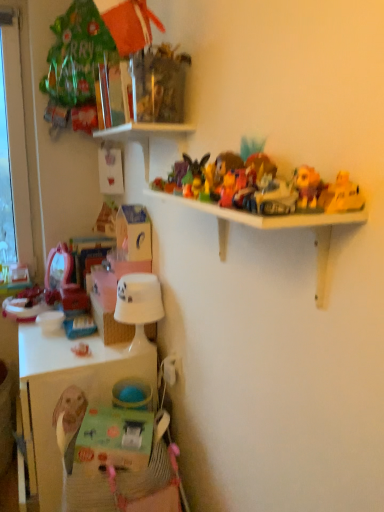
The height and width of the screenshot is (512, 384). In order to click on woven straw basket at lower center in this screenshot , I will do `click(110, 324)`.

Locate an element on the screen. The width and height of the screenshot is (384, 512). matte pink toy at lower left, the second toy when ordered from top to bottom is located at coordinates (81, 350).

Identify the location of matte cardboard box at lower left. This screenshot has width=384, height=512. (134, 232).

This screenshot has height=512, width=384. I want to click on white glossy lampshade at lower center, so click(x=139, y=306).

The image size is (384, 512). I want to click on woven straw basket at lower center, so click(110, 324).

Is matte cardboard box at lower left positioned with its back to plush yellow bear at upper right, marked as the 1th toy in a front-to-back arrangement?

No.

Is the depth of matte cardboard box at lower left less than that of plush yellow bear at upper right, positioned as the first toy in right-to-left order?

No, it is behind plush yellow bear at upper right, positioned as the first toy in right-to-left order.

From the image's perspective, is matte cardboard box at lower left on top of plush yellow bear at upper right, marked as the 1th toy in a front-to-back arrangement?

Correct, matte cardboard box at lower left appears higher than plush yellow bear at upper right, marked as the 1th toy in a front-to-back arrangement, in the image.

What are the coordinates of `box that is above the plush yellow bear at upper right, marked as the 1th toy in a top-to-bottom arrangement (from the image's perspective)` in the screenshot? It's located at tap(134, 232).

From a real-world perspective, which is physically above, woven straw basket at lower center or white plastic shelf at upper center?

In real-world perspective, white plastic shelf at upper center is above.

Considering the relative positions of woven straw basket at lower center and white plastic shelf at upper center in the image provided, is woven straw basket at lower center in front of white plastic shelf at upper center?

No, the depth of woven straw basket at lower center is greater than that of white plastic shelf at upper center.

Considering the relative positions of woven straw basket at lower center and white plastic shelf at upper center in the image provided, is woven straw basket at lower center to the right of white plastic shelf at upper center from the viewer's perspective?

No, woven straw basket at lower center is not to the right of white plastic shelf at upper center.

Considering the relative positions of plush yellow bear at upper right, positioned as the first toy in right-to-left order, and white glossy lampshade at lower center in the image provided, is plush yellow bear at upper right, positioned as the first toy in right-to-left order, to the left of white glossy lampshade at lower center from the viewer's perspective?

No, plush yellow bear at upper right, positioned as the first toy in right-to-left order, is not to the left of white glossy lampshade at lower center.

From the picture: Is plush yellow bear at upper right, marked as the 1th toy in a top-to-bottom arrangement, surrounding white glossy lampshade at lower center?

Definitely not — white glossy lampshade at lower center is not inside plush yellow bear at upper right, marked as the 1th toy in a top-to-bottom arrangement.

This screenshot has width=384, height=512. I want to click on lamp that appears below the plush yellow bear at upper right, the 2th toy positioned from the bottom (from a real-world perspective), so click(139, 306).

Which object is positioned more to the right, woven straw basket at lower center or matte cardboard box at lower left?

Positioned to the right is matte cardboard box at lower left.

From the image's perspective, between woven straw basket at lower center and matte cardboard box at lower left, which one is located above?

matte cardboard box at lower left, from the image's perspective.

Which object is closer to the camera, woven straw basket at lower center or matte cardboard box at lower left?

woven straw basket at lower center is more forward.

Is matte cardboard box at lower left at the back of woven straw basket at lower center?

No, matte cardboard box at lower left is not at the back of woven straw basket at lower center.

Considering the sizes of white cardboard cabinet at lower left and plush yellow bear at upper right, positioned as the first toy in right-to-left order, in the image, is white cardboard cabinet at lower left taller or shorter than plush yellow bear at upper right, positioned as the first toy in right-to-left order,?

white cardboard cabinet at lower left is taller than plush yellow bear at upper right, positioned as the first toy in right-to-left order.

Looking at this image, in the image, is white cardboard cabinet at lower left positioned in front of or behind plush yellow bear at upper right, marked as the 1th toy in a top-to-bottom arrangement?

white cardboard cabinet at lower left is positioned farther from the viewer than plush yellow bear at upper right, marked as the 1th toy in a top-to-bottom arrangement.

Is plush yellow bear at upper right, the 2th toy positioned from the bottom, a part of white cardboard cabinet at lower left?

No, plush yellow bear at upper right, the 2th toy positioned from the bottom, is not a part of white cardboard cabinet at lower left.

Is white cardboard cabinet at lower left wider or thinner than plush yellow bear at upper right, positioned as the first toy in right-to-left order?

Considering their sizes, white cardboard cabinet at lower left looks broader than plush yellow bear at upper right, positioned as the first toy in right-to-left order.

How many degrees apart are the facing directions of white glossy lampshade at lower center and white cardboard cabinet at lower left?

The angular difference between white glossy lampshade at lower center and white cardboard cabinet at lower left is 2.55 degrees.

From the image's perspective, is white glossy lampshade at lower center located above or below white cardboard cabinet at lower left?

Clearly, from the image's perspective, white glossy lampshade at lower center is above white cardboard cabinet at lower left.

Considering the positions of objects white glossy lampshade at lower center and white cardboard cabinet at lower left in the image provided, who is behind, white glossy lampshade at lower center or white cardboard cabinet at lower left?

Positioned behind is white glossy lampshade at lower center.

Is white glossy lampshade at lower center taller than white cardboard cabinet at lower left?

In fact, white glossy lampshade at lower center may be shorter than white cardboard cabinet at lower left.

Is matte pink toy at lower left, the 1th toy positioned from the back, touching white plastic shelf at upper center?

matte pink toy at lower left, the 1th toy positioned from the back, and white plastic shelf at upper center are clearly separated.

Between matte pink toy at lower left, the second toy when ordered from top to bottom, and white plastic shelf at upper center, which one has larger size?

Bigger between the two is white plastic shelf at upper center.

Looking at this image, from the image's perspective, is matte pink toy at lower left, the 1th toy positioned from the back, on top of white plastic shelf at upper center?

Incorrect, from the image's perspective, matte pink toy at lower left, the 1th toy positioned from the back, is lower than white plastic shelf at upper center.

At what (x,y) coordinates should I click in order to perform the action: click on toy that is the 2nd one when counting forward from the matte cardboard box at lower left. Please return your answer as a coordinate pair (x, y). This screenshot has height=512, width=384. Looking at the image, I should click on (307, 187).

The width and height of the screenshot is (384, 512). I want to click on basket behind the white plastic shelf at upper center, so click(110, 324).

Considering their positions, is woven straw basket at lower center positioned further to white plastic shelf at upper center than plush yellow bear at upper right, the 2th toy viewed from the left?

woven straw basket at lower center lies further to white plastic shelf at upper center than the other object.

Which object lies nearer to the anchor point matte pink toy at lower left, the second toy when ordered from top to bottom, white glossy lampshade at lower center or plush yellow bear at upper right, marked as the 1th toy in a front-to-back arrangement?

white glossy lampshade at lower center is closer to matte pink toy at lower left, the second toy when ordered from top to bottom.

Looking at the image, which one is located closer to white plastic shelf at upper center, plush yellow bear at upper right, marked as the 1th toy in a front-to-back arrangement, or matte pink toy at lower left, the second toy when ordered from top to bottom?

Based on the image, plush yellow bear at upper right, marked as the 1th toy in a front-to-back arrangement, appears to be nearer to white plastic shelf at upper center.

Looking at the image, which one is located further to white glossy lampshade at lower center, plush yellow bear at upper right, marked as the 1th toy in a front-to-back arrangement, or white plastic shelf at upper center?

plush yellow bear at upper right, marked as the 1th toy in a front-to-back arrangement.

Which object lies further to the anchor point matte cardboard box at lower left, woven straw basket at lower center or matte pink toy at lower left, positioned as the 1th toy in bottom-to-top order?

matte pink toy at lower left, positioned as the 1th toy in bottom-to-top order, lies further to matte cardboard box at lower left than the other object.

Estimate the real-world distances between objects in this image. Which object is further from white cardboard cabinet at lower left, woven straw basket at lower center or plush yellow bear at upper right, the 2th toy positioned from the bottom?

plush yellow bear at upper right, the 2th toy positioned from the bottom, is positioned further to the anchor white cardboard cabinet at lower left.

Based on their spatial positions, is plush yellow bear at upper right, marked as the 1th toy in a top-to-bottom arrangement, or white cardboard cabinet at lower left further from woven straw basket at lower center?

Based on the image, plush yellow bear at upper right, marked as the 1th toy in a top-to-bottom arrangement, appears to be further to woven straw basket at lower center.

Estimate the real-world distances between objects in this image. Which object is further from matte cardboard box at lower left, plush yellow bear at upper right, the 2th toy viewed from the left, or white glossy lampshade at lower center?

The object further to matte cardboard box at lower left is plush yellow bear at upper right, the 2th toy viewed from the left.

Find the location of a particular element. This screenshot has height=512, width=384. toy between white glossy lampshade at lower center and white cardboard cabinet at lower left in the vertical direction is located at coordinates (81, 350).

What are the coordinates of `basket between matte pink toy at lower left, positioned as the second toy in front-to-back order, and white glossy lampshade at lower center from left to right` in the screenshot? It's located at (110, 324).

Find the location of `cabinetry between plush yellow bear at upper right, marked as the 1th toy in a top-to-bottom arrangement, and matte cardboard box at lower left from front to back`. cabinetry between plush yellow bear at upper right, marked as the 1th toy in a top-to-bottom arrangement, and matte cardboard box at lower left from front to back is located at coordinates (64, 391).

Find the location of a particular element. The width and height of the screenshot is (384, 512). cabinetry located between plush yellow bear at upper right, marked as the 1th toy in a top-to-bottom arrangement, and matte pink toy at lower left, which is counted as the first toy, starting from the left, in the depth direction is located at coordinates (64, 391).